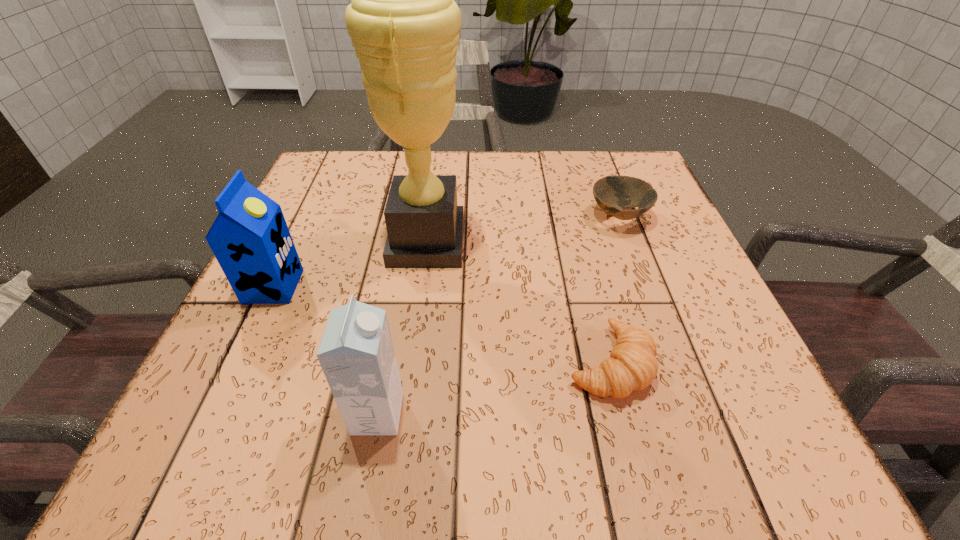
Find the location of a particular element. free spot located on the back of the crescent roll is located at coordinates (588, 275).

Where is `object that is positioned at the far edge`? object that is positioned at the far edge is located at coordinates (612, 193).

Identify the location of object at the near edge. (356, 353).

Identify the location of object that is at the left edge. (250, 239).

The width and height of the screenshot is (960, 540). In order to click on bowl positioned at the right edge in this screenshot , I will do pyautogui.click(x=612, y=193).

Locate an element on the screen. crescent roll located at the right edge is located at coordinates (632, 366).

Locate an element on the screen. This screenshot has width=960, height=540. object present at the far right corner is located at coordinates (612, 193).

The height and width of the screenshot is (540, 960). I want to click on free location at the far edge, so [x=556, y=184].

I want to click on free space at the near edge of the desktop, so click(664, 425).

I want to click on vacant space at the left edge of the desktop, so click(x=310, y=327).